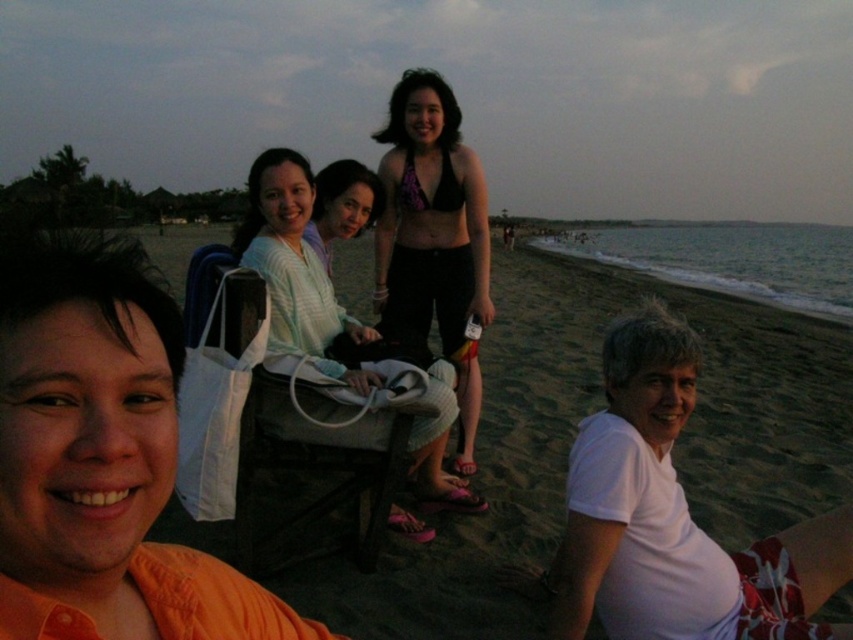
Question: Does orange fabric shirt at left appear on the left side of light blue striped shirt at center?

Choices:
 (A) yes
 (B) no

Answer: (B)

Question: Does orange fabric shirt at left appear on the left side of white fabric beach chair at center?

Choices:
 (A) no
 (B) yes

Answer: (A)

Question: Is orange fabric shirt at left smaller than white fabric beach chair at center?

Choices:
 (A) no
 (B) yes

Answer: (B)

Question: Which point appears farthest from the camera in this image?

Choices:
 (A) (813, 401)
 (B) (485, 250)
 (C) (288, 221)
 (D) (129, 280)

Answer: (A)

Question: Which object is closer to the camera taking this photo?

Choices:
 (A) light blue striped shirt at center
 (B) orange fabric shirt at left

Answer: (B)

Question: Which of the following is the closest to the observer?

Choices:
 (A) light blue striped shirt at center
 (B) white fabric beach chair at center
 (C) beige sand at lower center
 (D) orange fabric shirt at left

Answer: (D)